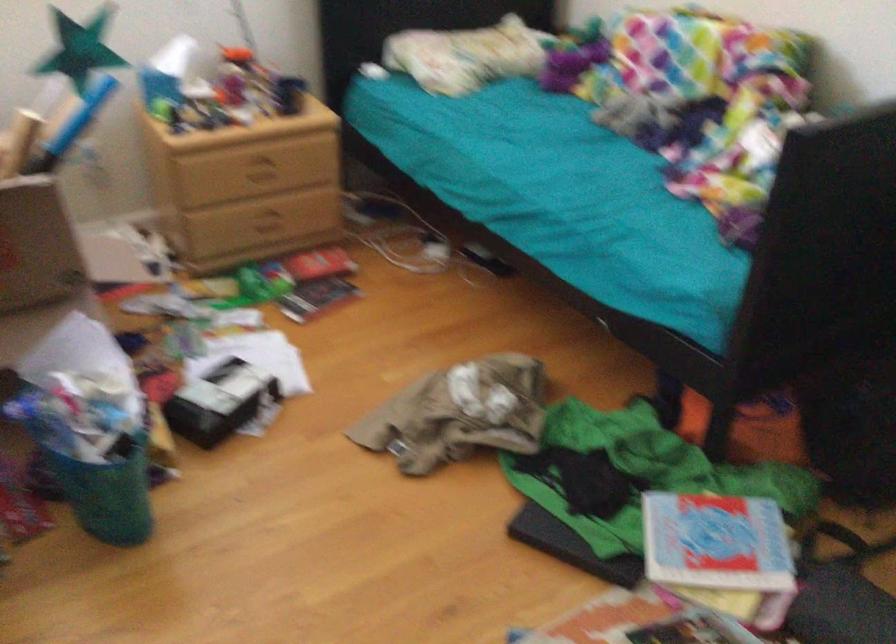
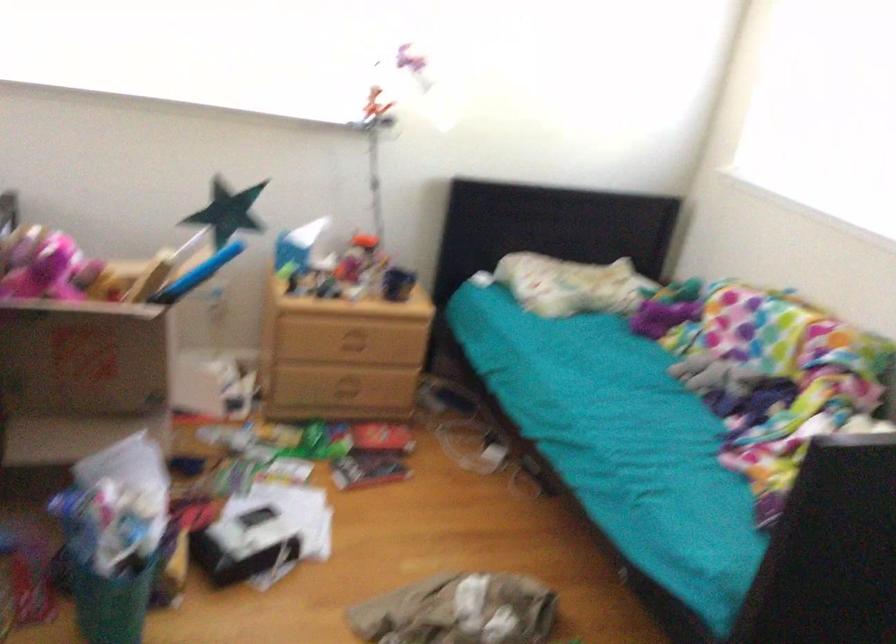
The point at (108, 478) is marked in the first image. Where is the corresponding point in the second image?

(108, 592)